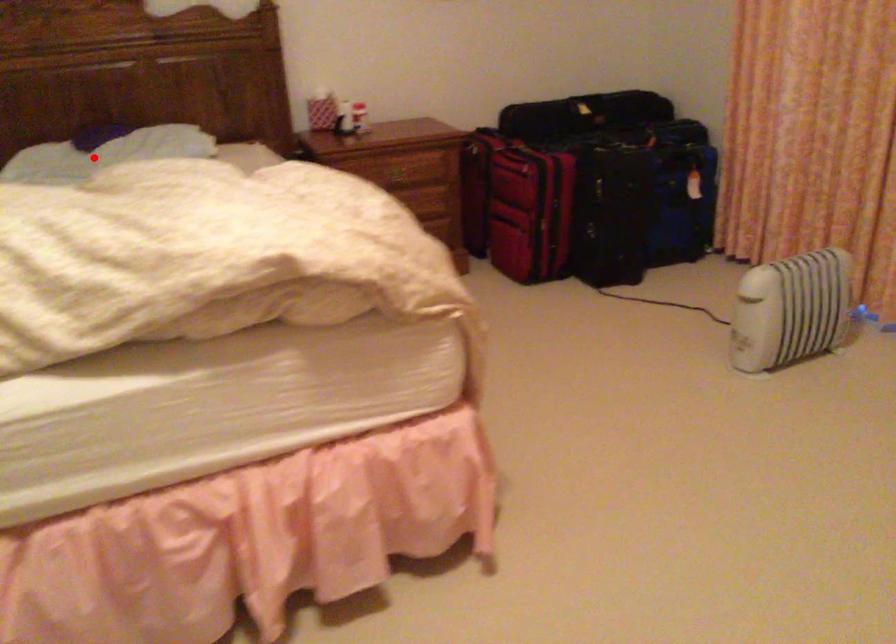
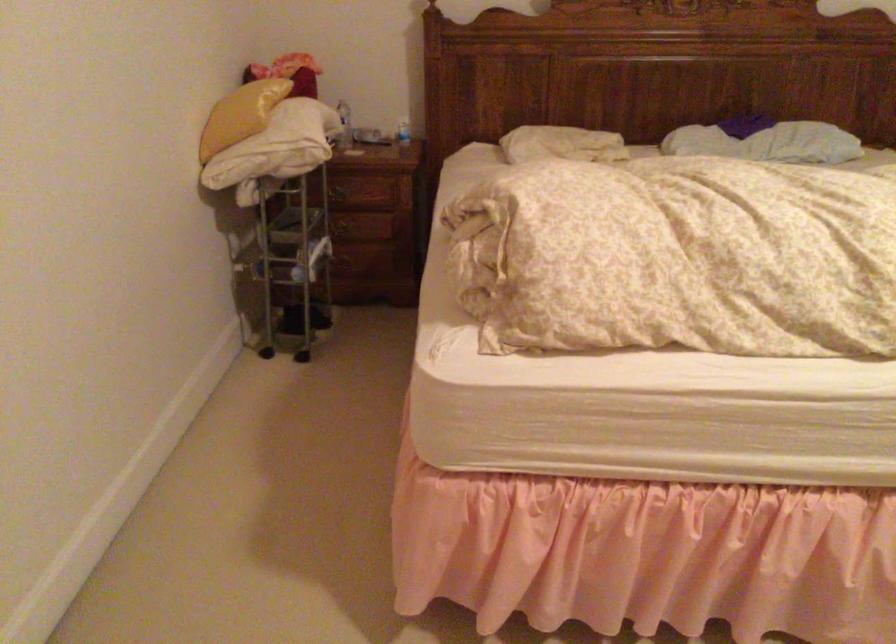
The point at the highlighted location is marked in the first image. Where is the corresponding point in the second image?

(767, 142)